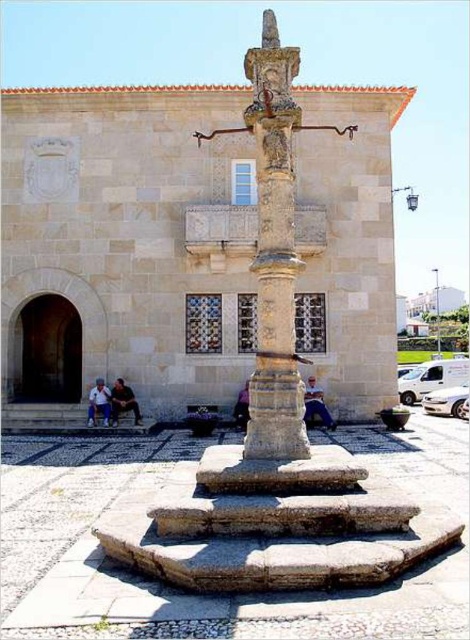
Question: Is stone column at center thinner than dark blue jeans at lower center?

Choices:
 (A) no
 (B) yes

Answer: (A)

Question: Where is light blue denim jeans at lower left located in relation to dark purple fabric at center in the image?

Choices:
 (A) left
 (B) right

Answer: (A)

Question: Can you confirm if light blue denim jeans at lower left is positioned to the right of dark purple fabric at center?

Choices:
 (A) yes
 (B) no

Answer: (B)

Question: Which object is closer to the camera taking this photo?

Choices:
 (A) smooth gray pole at center
 (B) smooth stone totem pole at center
 (C) light blue denim jeans at lower left
 (D) dark purple fabric at center

Answer: (B)

Question: Which point is closer to the camera?

Choices:
 (A) dark blue jeans at lower center
 (B) dark purple fabric at center
 (C) stone column at center

Answer: (C)

Question: Which point is farther from the camera taking this photo?

Choices:
 (A) (435, 296)
 (B) (117, 385)
 (C) (245, 403)
 (D) (274, 314)

Answer: (A)